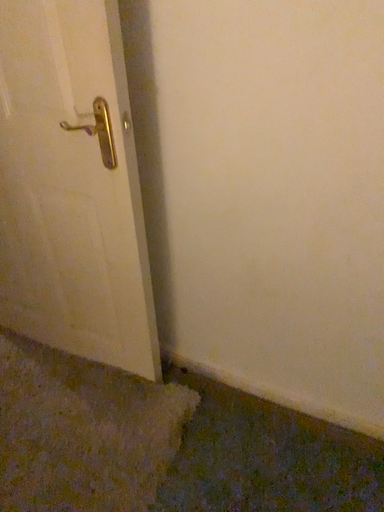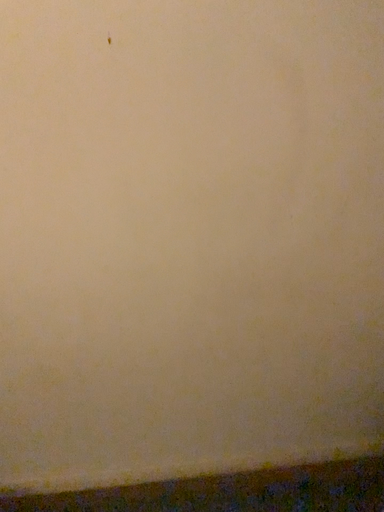
Question: How did the camera likely rotate when shooting the video?

Choices:
 (A) rotated downward
 (B) rotated upward

Answer: (B)